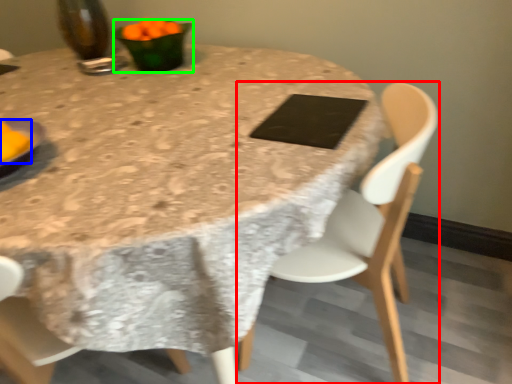
Question: Which is farther away from chair (highlighted by a red box)? food (highlighted by a blue box) or tableware (highlighted by a green box)?

Choices:
 (A) food
 (B) tableware

Answer: (A)